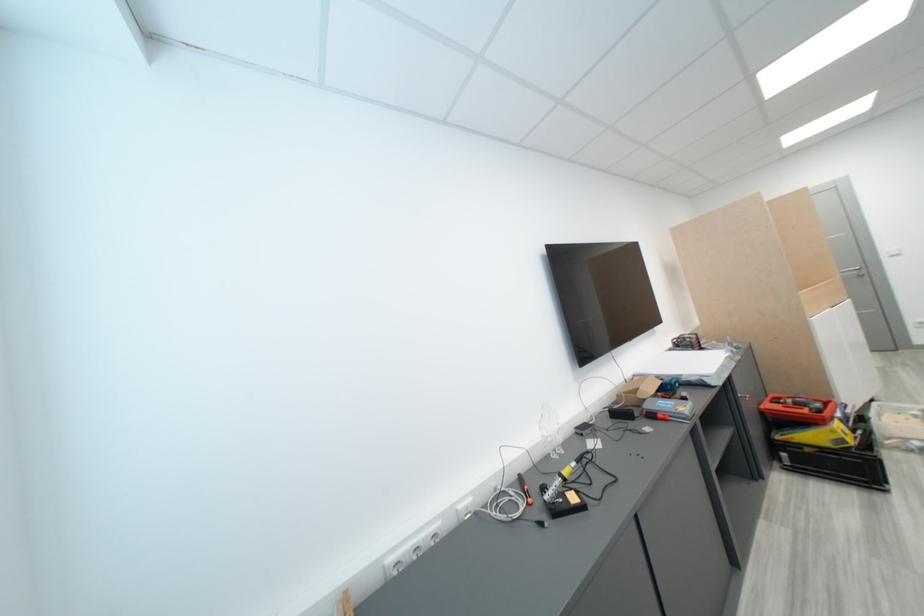
This screenshot has width=924, height=616. I want to click on silver door handle, so click(861, 275).